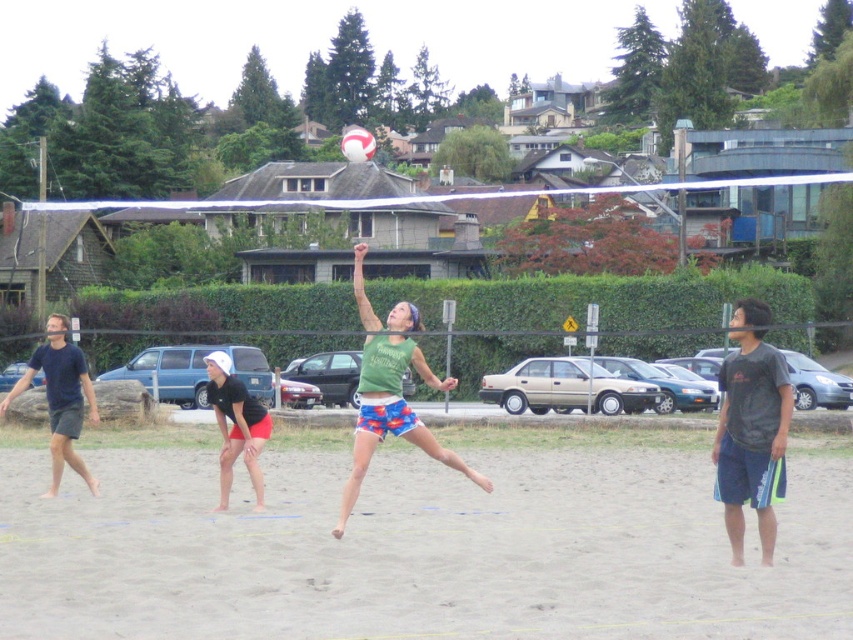
Question: Is dark blue t-shirt at left closer to the viewer compared to matte black shorts at lower left?

Choices:
 (A) no
 (B) yes

Answer: (A)

Question: Is green fabric tank top at center closer to camera compared to white matte volleyball at center?

Choices:
 (A) no
 (B) yes

Answer: (B)

Question: Which object is the farthest from the green fabric tank top at center?

Choices:
 (A) dark blue t-shirt at left
 (B) dark gray t-shirt at right
 (C) matte black shorts at lower left

Answer: (B)

Question: Can you confirm if dark blue t-shirt at left is positioned to the left of matte black shorts at lower left?

Choices:
 (A) yes
 (B) no

Answer: (A)

Question: Which of the following is the closest to the observer?

Choices:
 (A) (764, 438)
 (B) (47, 348)
 (C) (424, 432)

Answer: (A)

Question: Which of the following is the farthest from the observer?

Choices:
 (A) (351, 154)
 (B) (74, 422)

Answer: (A)